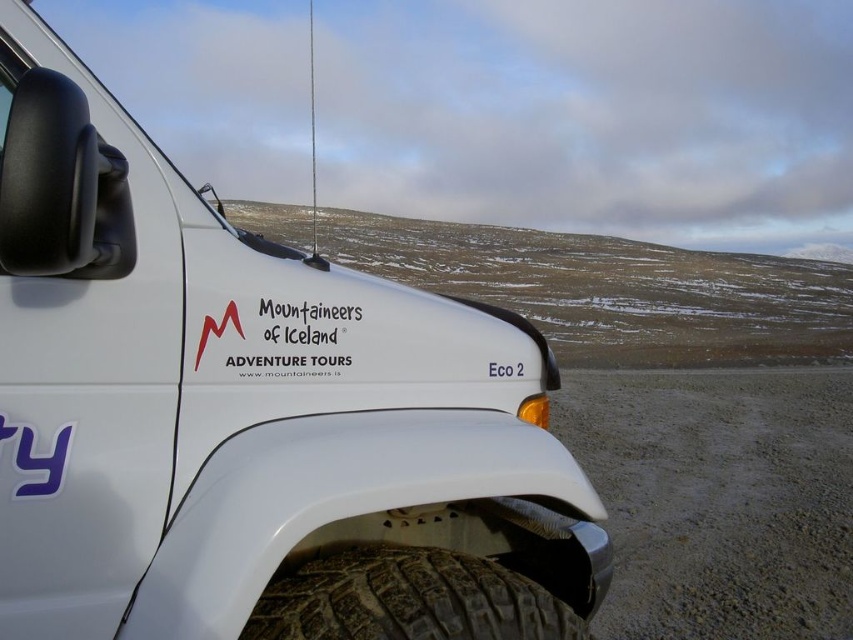
You are driving a car that requires a minimum of 3 meters of clearance to safely turn around. Based on the scene described, can you safely turn around in the space between the white matte vehicle at center and the gray gravel dirt track at lower right?

The distance between the white matte vehicle at center and the gray gravel dirt track at lower right is 3.18 meters, which exceeds the required 3 meters clearance. Therefore, you can safely turn around in the space between the white matte vehicle at center and the gray gravel dirt track at lower right.

You are standing 1 meter away from a white matte vehicle at center. If you take one step forward, will you be closer than the distance specified in the scene description?

The distance of white matte vehicle at center from viewer is 1.01 meters. If you take one step forward, you would be closer than the specified distance.

You are a delivery person who needs to park your vehicle in a parking spot with coordinates marked at point 0.648, 0.295. Can you safely park your vehicle in the same spot as the white matte vehicle at center?

The white matte vehicle at center is positioned at point (251, 413), so yes, you can safely park your vehicle in the same spot as the white matte vehicle at center since the coordinates match.